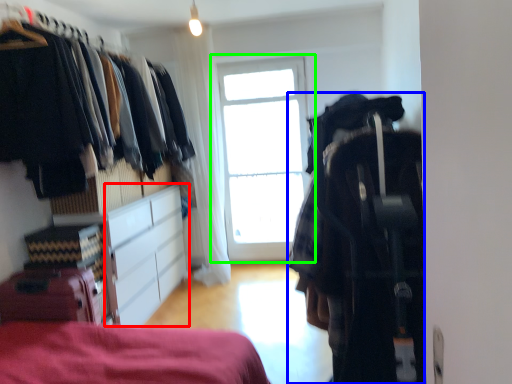
Question: Based on their relative distances, which object is nearer to cabinetry (highlighted by a red box)? Choose from clothing (highlighted by a blue box) and window (highlighted by a green box).

Choices:
 (A) clothing
 (B) window

Answer: (B)